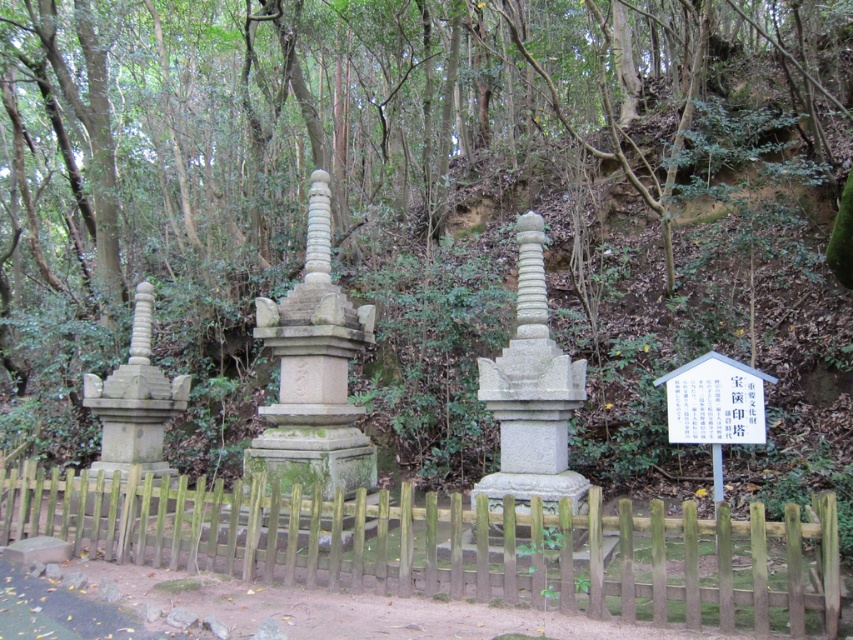
You are a visitor standing at the entrance of the fenced enclosure. You notice the gray stone pagoda at center and the gray stone pillar at center. Which one appears bigger to you?

The gray stone pagoda at center is larger in size than the gray stone pillar at center, so the pagoda appears bigger.

You are a visitor standing at the entrance of the fenced enclosure. You see the brown wooden fence at center and the gray stone pillar at center. Which object is bigger in size?

The gray stone pillar at center is bigger in size compared to the brown wooden fence at center.

You are standing at the origin point of the coordinate system. You want to walk towards the brown wooden fence at center. What direction should you head in?

Since the brown wooden fence at center is located at coordinate point [426,541], you should head in the positive x direction to reach it.